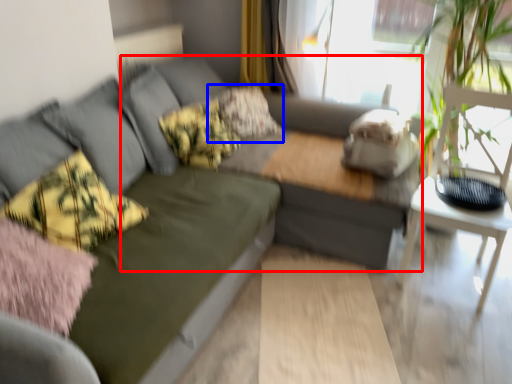
Question: Which object appears closest to the camera in this image, couch (highlighted by a red box) or pillow (highlighted by a blue box)?

Choices:
 (A) couch
 (B) pillow

Answer: (A)